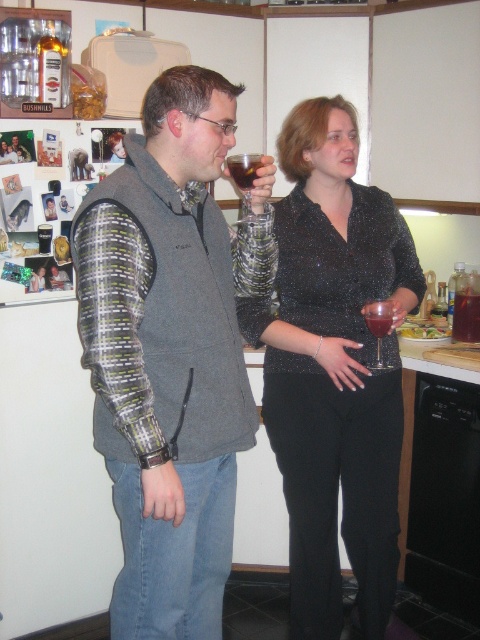
Question: Which point is closer to the camera?

Choices:
 (A) dark red glass at center
 (B) transparent glass at upper center
 (C) dark red liquid at center
 (D) gray fleece vest at center

Answer: (D)

Question: Can you confirm if dark brown liquid at upper center is positioned above dark red glass at center?

Choices:
 (A) yes
 (B) no

Answer: (A)

Question: Which object appears farthest from the camera in this image?

Choices:
 (A) transparent glass at upper center
 (B) sparkly black blouse at center
 (C) dark red glass at center

Answer: (B)

Question: Does gray fleece vest at center lie in front of sparkly black blouse at center?

Choices:
 (A) yes
 (B) no

Answer: (A)

Question: Can you confirm if dark red liquid at center is thinner than transparent glass at center?

Choices:
 (A) yes
 (B) no

Answer: (B)

Question: Which object is farther from the camera taking this photo?

Choices:
 (A) sparkly black blouse at center
 (B) transparent glass at center
 (C) dark red liquid at center
 (D) dark brown liquid at upper center

Answer: (C)